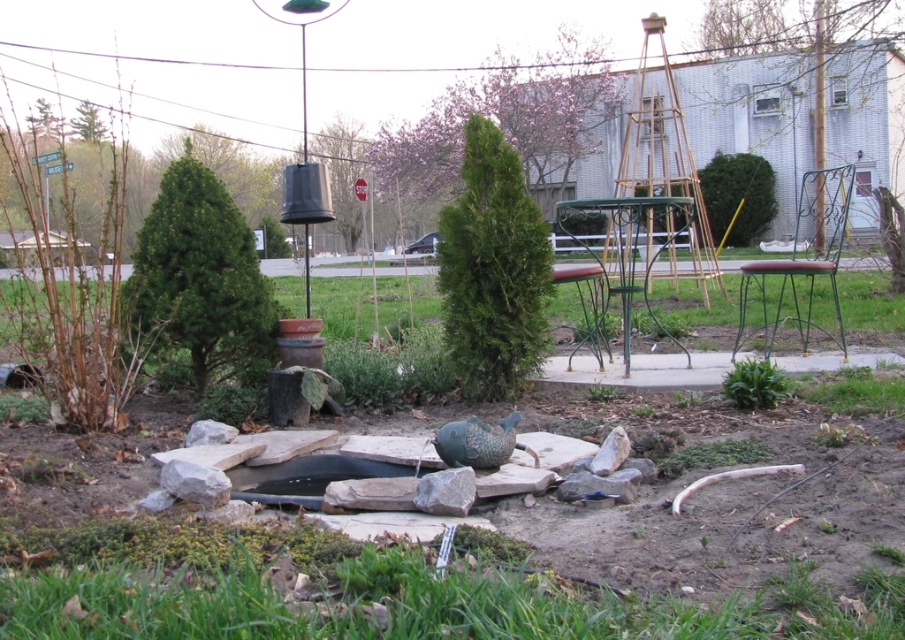
You are a gardener planning to plant a new flower bed between the green textured tree at upper center and the green textured tree at center. Which tree should you plant closer to for better growth, considering their sizes?

You should plant the new flower bed closer to the green textured tree at upper center because it is bigger and likely provides more shade and nutrients compared to the smaller green textured tree at center.

You are standing in the garden and want to place a new decorative item between the green textured tree at upper center and the decorative fish statue near the edge of the water. Based on their positions, which object is closer to the center of the garden?

The green textured tree at upper center is located at point (x=505, y=124), so it is closer to the center of the garden compared to the decorative fish statue near the edge of the water.